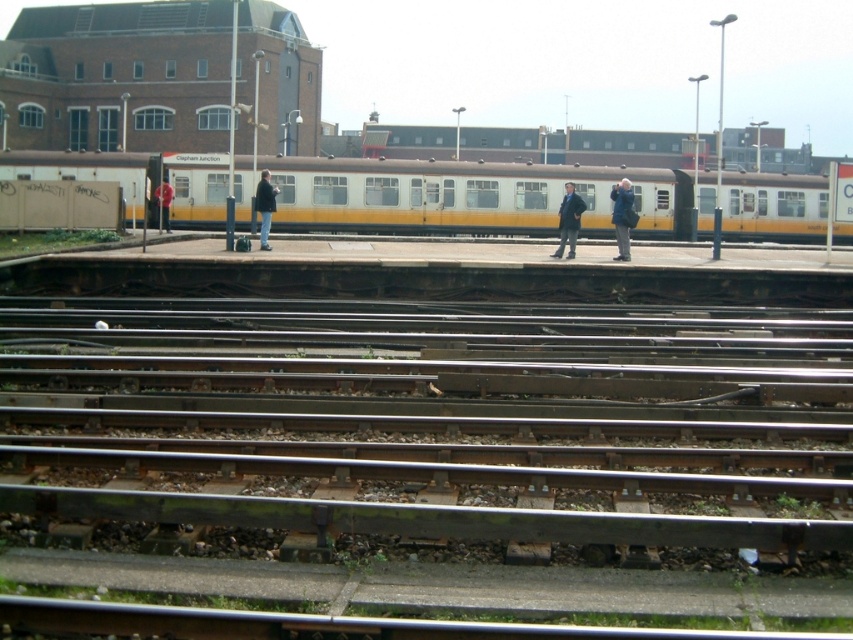
You are a passenger waiting at the station and see both the dark gray jacket at center and the red fabric jacket at left. Which person is standing closer to the tracks?

The dark gray jacket at center is below the red fabric jacket at left, meaning the person wearing the dark gray jacket at center is closer to the tracks.

You are a photographer standing at the railway station. You want to take a photo of the two people wearing dark blue jacket at center and dark gray jacket at center. Which jacket is narrower when viewed from your position?

The dark blue jacket at center is thinner than the dark gray jacket at center, so the dark blue jacket at center is narrower when viewed from your position.

Consider the image. You are a passenger waiting at the station and see the dark gray jacket at center and the red fabric jacket at left. Which person is closer to you?

The dark gray jacket at center is closer to you because it is in front of the red fabric jacket at left.